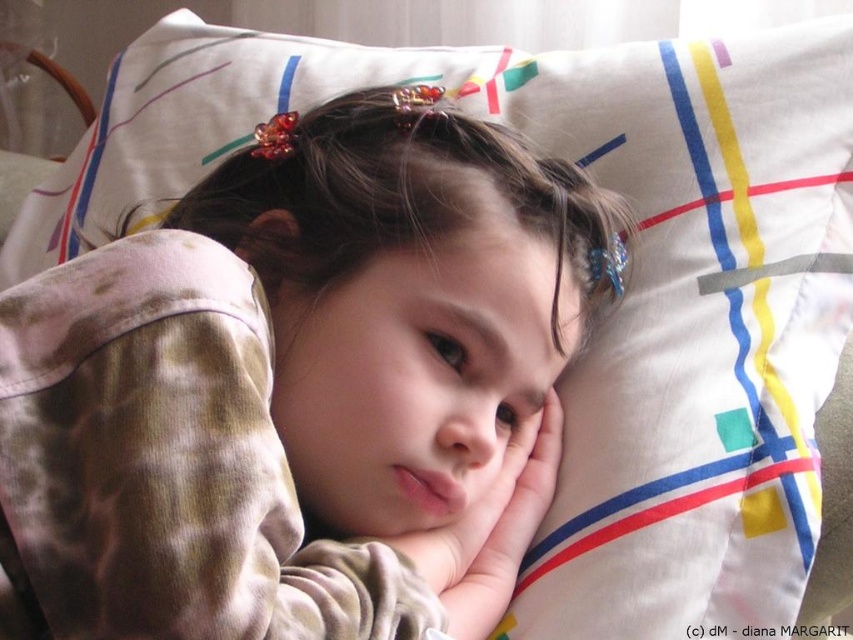
Is the position of camouflage pajamas at center less distant than that of soft skin hand at center?

Yes, camouflage pajamas at center is in front of soft skin hand at center.

Between camouflage pajamas at center and soft skin hand at center, which one has more height?

camouflage pajamas at center

Based on the photo, who is more forward, [86,588] or [544,513]?

Point [86,588] is more forward.

Where is `camouflage pajamas at center`? This screenshot has width=853, height=640. camouflage pajamas at center is located at coordinates point(302,388).